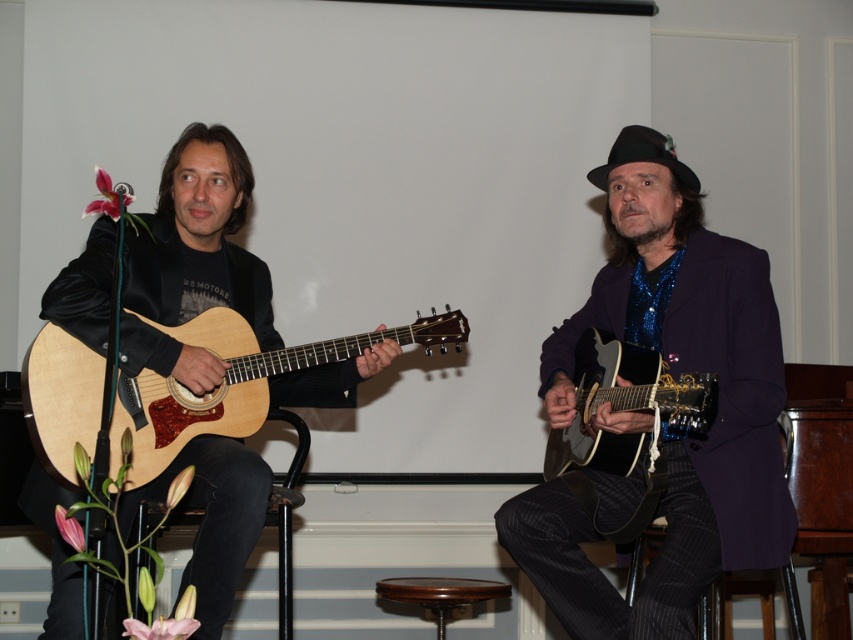
Can you confirm if matte black guitar at left is taller than wooden acoustic guitar at right?

Yes.

Is point (148, 332) farther from camera compared to point (653, 394)?

Yes, it is behind point (653, 394).

In order to click on matte black guitar at left in this screenshot , I will do `click(199, 237)`.

Where is `matte black guitar at left`? This screenshot has height=640, width=853. matte black guitar at left is located at coordinates (199, 237).

What do you see at coordinates (668, 428) in the screenshot? I see `shiny blue sequined shirt at right` at bounding box center [668, 428].

I want to click on shiny blue sequined shirt at right, so click(x=668, y=428).

Is natural wood acoustic guitar at left taller than wooden acoustic guitar at right?

Yes, natural wood acoustic guitar at left is taller than wooden acoustic guitar at right.

Is point (239, 435) more distant than point (659, 364)?

Yes, it is behind point (659, 364).

Who is more forward, (78, 346) or (579, 353)?

Positioned in front is point (78, 346).

At what (x,y) coordinates should I click in order to perform the action: click on natural wood acoustic guitar at left. Please return your answer as a coordinate pair (x, y). Looking at the image, I should click on (231, 384).